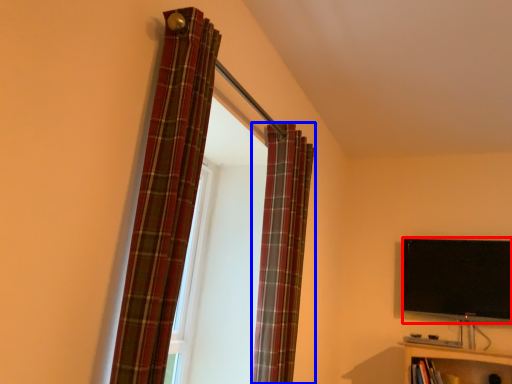
Question: Which object is closer to the camera taking this photo, television (highlighted by a red box) or curtain (highlighted by a blue box)?

Choices:
 (A) television
 (B) curtain

Answer: (B)